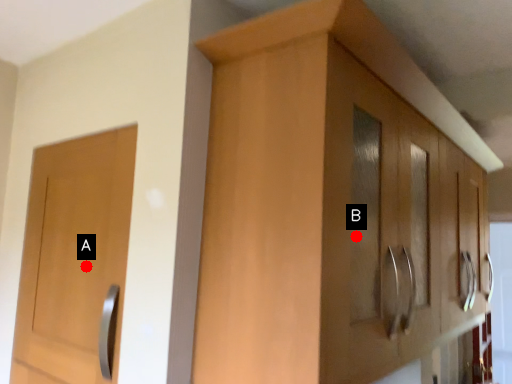
Question: Two points are circled on the image, labeled by A and B beside each circle. Which of the following is the closest to the observer?

Choices:
 (A) A is closer
 (B) B is closer

Answer: (B)